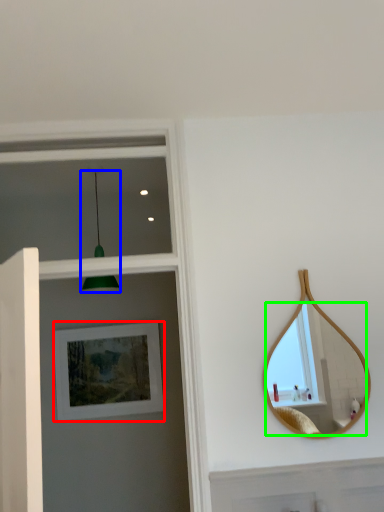
Question: Estimate the real-world distances between objects in this image. Which object is farther from picture frame (highlighted by a red box), light fixture (highlighted by a blue box) or mirror (highlighted by a green box)?

Choices:
 (A) light fixture
 (B) mirror

Answer: (B)